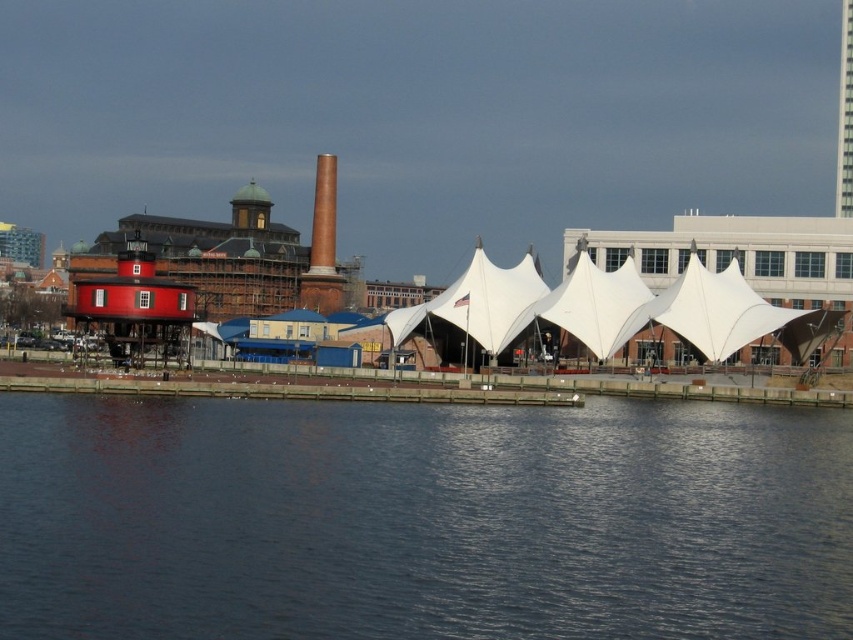
Who is shorter, white fabric tent at center or white fabric canopy at center?

Standing shorter between the two is white fabric canopy at center.

Does white fabric tent at center appear on the right side of white fabric canopy at center?

In fact, white fabric tent at center is to the left of white fabric canopy at center.

Locate an element on the screen. This screenshot has width=853, height=640. white fabric tent at center is located at coordinates pyautogui.click(x=614, y=308).

Identify the location of white fabric tent at center. (614, 308).

Which is above, dark blue water at lower center or white fabric canopy at center?

white fabric canopy at center is above.

From the picture: Measure the distance between dark blue water at lower center and camera.

The distance of dark blue water at lower center from camera is 103.88 feet.

Locate an element on the screen. dark blue water at lower center is located at coordinates (421, 518).

Who is taller, dark blue water at lower center or white fabric tent at center?

white fabric tent at center is taller.

Is dark blue water at lower center to the right of white fabric tent at center from the viewer's perspective?

In fact, dark blue water at lower center is to the left of white fabric tent at center.

Locate an element on the screen. dark blue water at lower center is located at coordinates (421, 518).

You are a GUI agent. You are given a task and a screenshot of the screen. Output one action in this format:
    pyautogui.click(x=<x>, y=<y>)
    Task: Click on the dark blue water at lower center
    This screenshot has width=853, height=640.
    Given the screenshot: What is the action you would take?
    pyautogui.click(x=421, y=518)